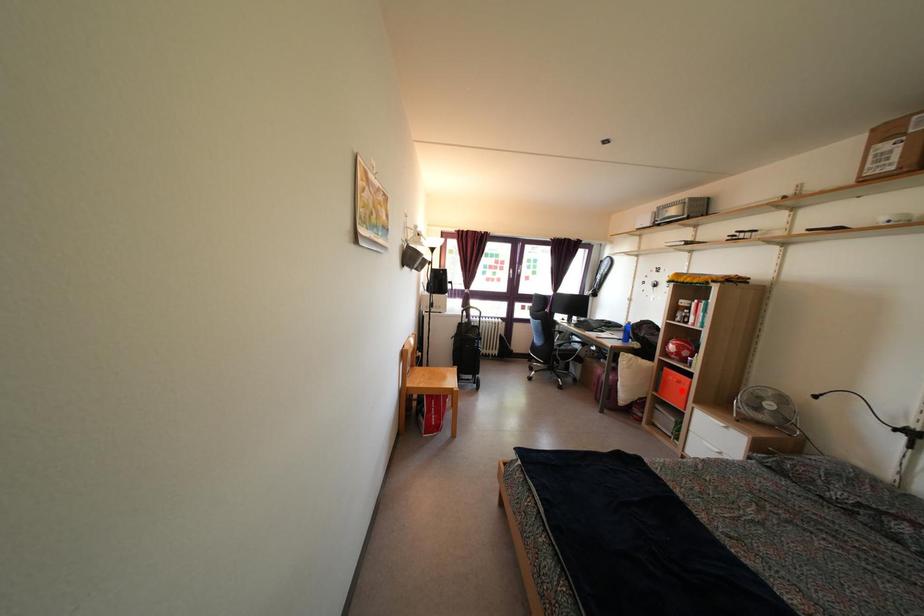
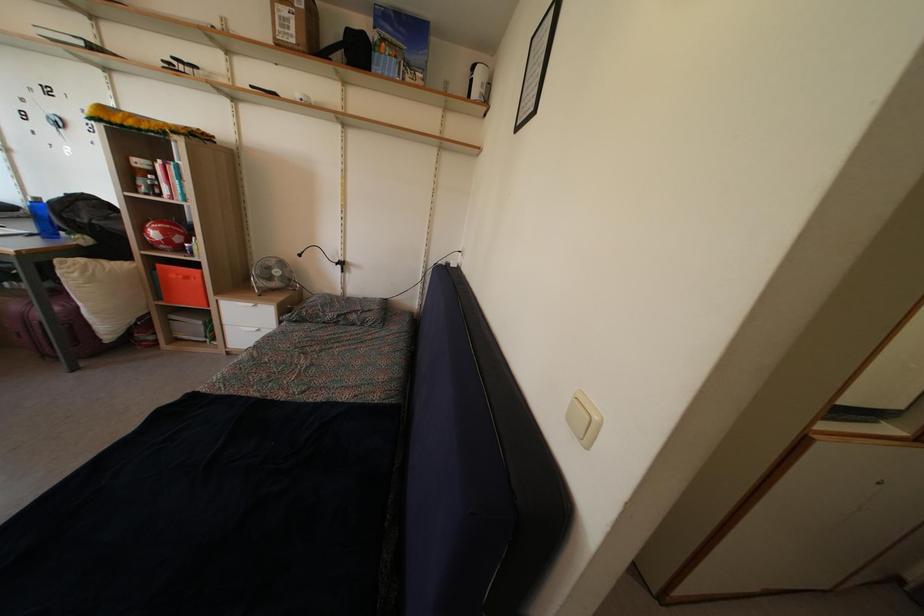
In the second image, find the point that corresponds to the highlighted location in the first image.

(189, 286)